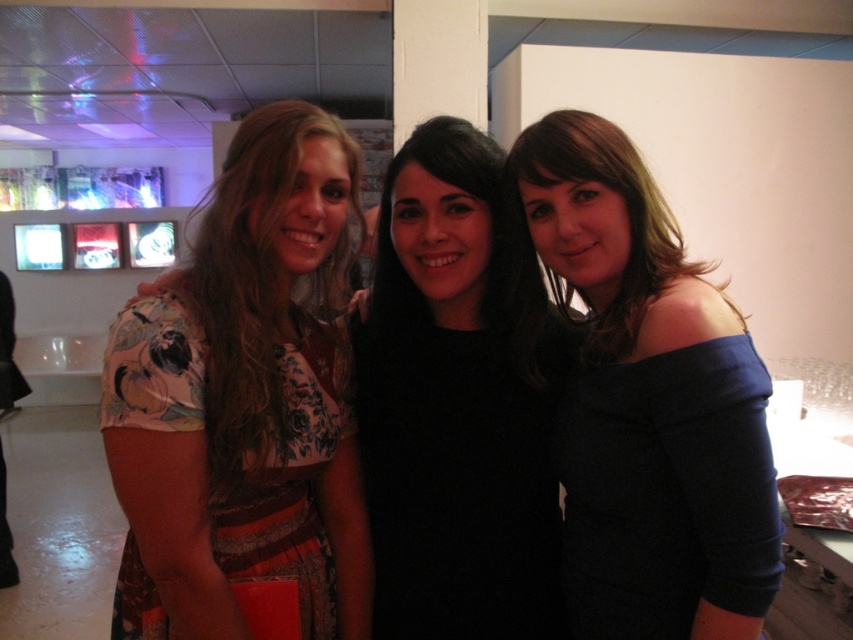
Question: Considering the relative positions of black matte dress at center and floral-patterned fabric dress at left in the image provided, where is black matte dress at center located with respect to floral-patterned fabric dress at left?

Choices:
 (A) right
 (B) left

Answer: (A)

Question: Considering the relative positions of blue matte dress at center and floral-patterned fabric dress at left in the image provided, where is blue matte dress at center located with respect to floral-patterned fabric dress at left?

Choices:
 (A) right
 (B) left

Answer: (A)

Question: Which of the following is the closest to the observer?

Choices:
 (A) black matte dress at center
 (B) blue cotton dress at center
 (C) blue matte dress at center
 (D) floral-patterned fabric dress at left

Answer: (B)

Question: Is black matte dress at center to the left of floral-patterned fabric dress at left from the viewer's perspective?

Choices:
 (A) no
 (B) yes

Answer: (A)

Question: Which object is positioned closest to the black matte dress at center?

Choices:
 (A) blue cotton dress at center
 (B) blue matte dress at center

Answer: (A)

Question: Which object is the closest to the blue matte dress at center?

Choices:
 (A) blue cotton dress at center
 (B) black matte dress at center

Answer: (A)